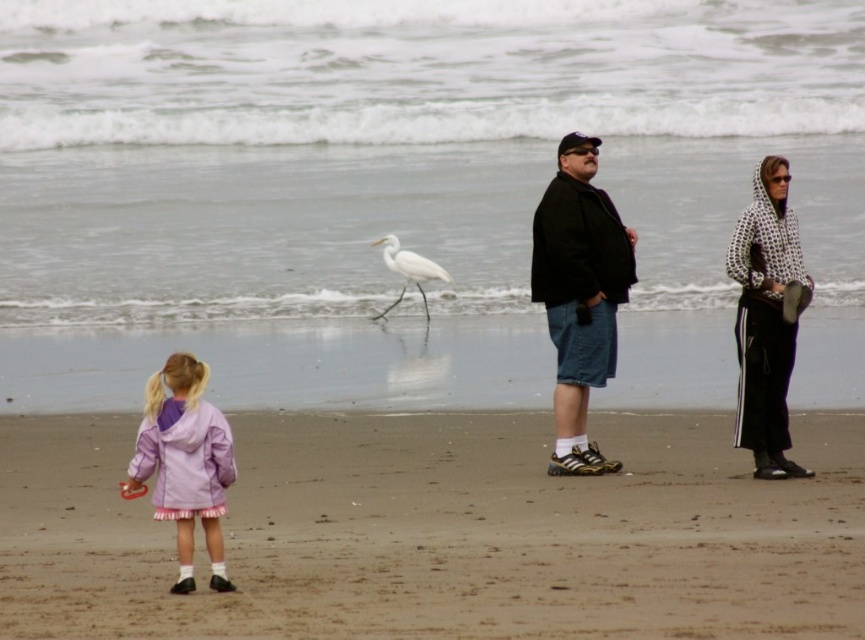
Question: Can you confirm if light brown sand at lower center is positioned above purple fleece jacket at lower left?

Choices:
 (A) no
 (B) yes

Answer: (A)

Question: Can you confirm if light brown sand at lower center is positioned to the right of white matte bird at center?

Choices:
 (A) no
 (B) yes

Answer: (B)

Question: Among these objects, which one is nearest to the camera?

Choices:
 (A) purple fleece jacket at lower left
 (B) black matte jacket at center
 (C) white dotted hoodie at right
 (D) light brown sand at lower center

Answer: (D)

Question: Estimate the real-world distances between objects in this image. Which object is farther from the white dotted hoodie at right?

Choices:
 (A) white matte bird at center
 (B) purple fleece jacket at lower left

Answer: (A)

Question: Where is light brown sand at lower center located in relation to white dotted hoodie at right in the image?

Choices:
 (A) below
 (B) above

Answer: (A)

Question: Which of the following is the closest to the observer?

Choices:
 (A) white matte bird at center
 (B) light brown sand at lower center
 (C) white dotted hoodie at right

Answer: (B)